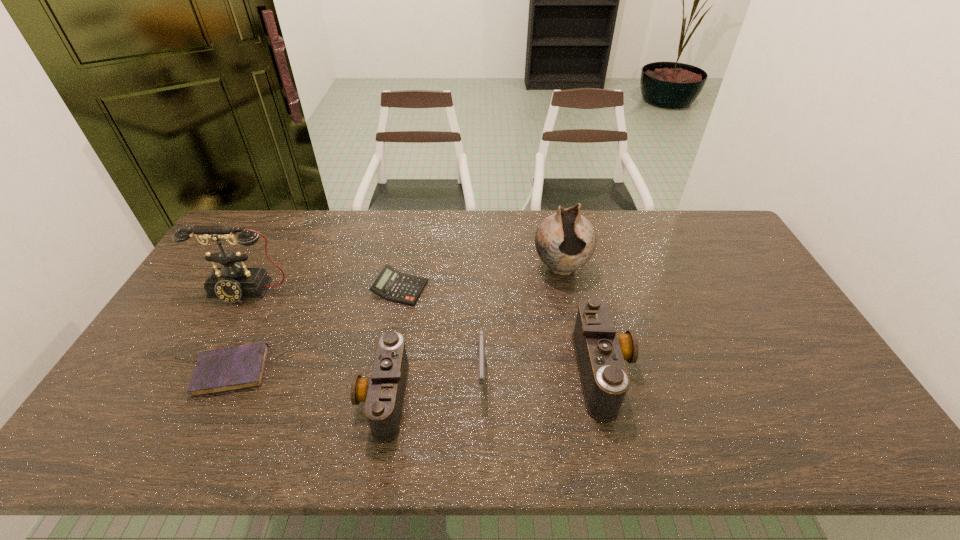
Identify the location of unoccupied area between the calculator and the telephone. The image size is (960, 540). click(323, 290).

Where is `vacant point located between the left camera and the pottery`? vacant point located between the left camera and the pottery is located at coordinates (472, 332).

Identify the location of unoccupied position between the shortest object and the pistol. This screenshot has height=540, width=960. (357, 372).

Locate an element on the screen. This screenshot has width=960, height=540. blank region between the diary and the fifth object from left to right is located at coordinates (357, 372).

Identify the location of empty location between the shortest object and the pottery. (396, 319).

At what (x,y) coordinates should I click in order to perform the action: click on object that stands as the closest to the taller camera. Please return your answer as a coordinate pair (x, y). The width and height of the screenshot is (960, 540). Looking at the image, I should click on (565, 241).

Identify which object is located as the second nearest to the fifth object from left to right. Please provide its 2D coordinates. Your answer should be formatted as a tuple, i.e. [(x, y)], where the tuple contains the x and y coordinates of a point satisfying the conditions above.

[(392, 285)]